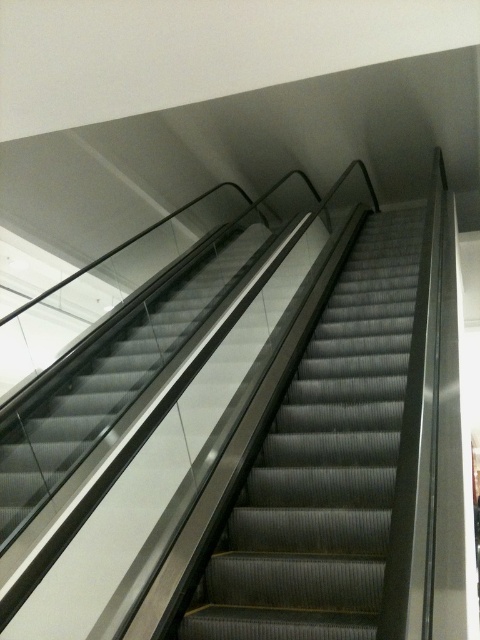
Question: Which object is closer to the camera taking this photo?

Choices:
 (A) metallic gray escalator at left
 (B) metallic gray escalator at center

Answer: (B)

Question: Observing the image, what is the correct spatial positioning of metallic gray escalator at center in reference to metallic gray escalator at left?

Choices:
 (A) above
 (B) below

Answer: (B)

Question: Where is metallic gray escalator at center located in relation to metallic gray escalator at left in the image?

Choices:
 (A) right
 (B) left

Answer: (A)

Question: Can you confirm if metallic gray escalator at center is positioned above metallic gray escalator at left?

Choices:
 (A) yes
 (B) no

Answer: (B)